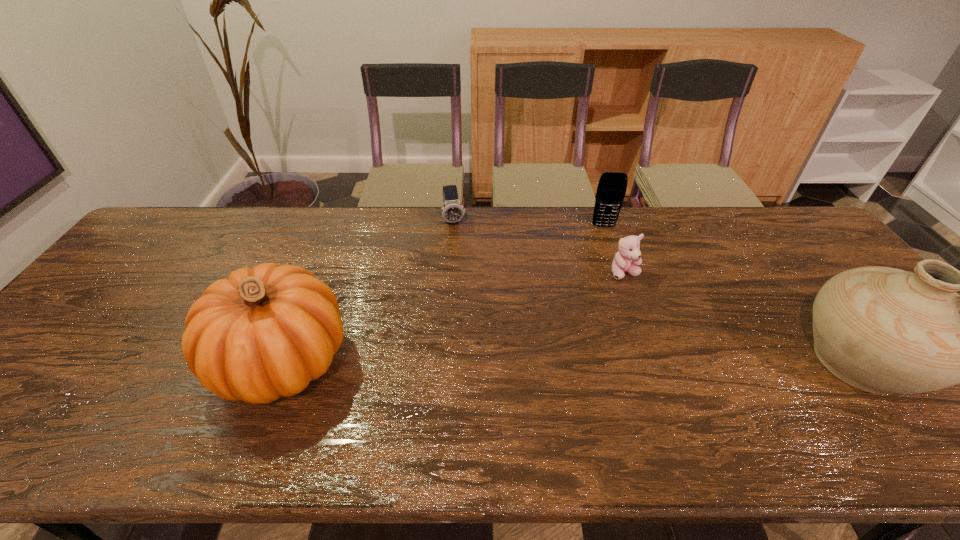
I want to click on free space on the desktop that is between the leftmost object and the pottery and is positioned on the screen of the third shortest object, so click(x=632, y=361).

Identify the location of vacant spot on the desktop that is between the leftmost object and the pottery and is positioned on the face of the fourth object from right to left. The height and width of the screenshot is (540, 960). (486, 361).

You are a GUI agent. You are given a task and a screenshot of the screen. Output one action in this format:
    pyautogui.click(x=<x>, y=<y>)
    Task: Click on the free spot on the desktop that is between the leftmost object and the rightmost object and is positioned at the face of the third nearest object
    The height and width of the screenshot is (540, 960).
    Given the screenshot: What is the action you would take?
    pyautogui.click(x=655, y=361)